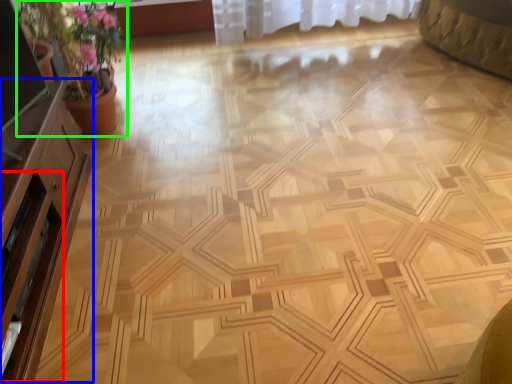
Question: Which object is the closest to the screen door (highlighted by a red box)? Choose among these: dresser (highlighted by a blue box) or houseplant (highlighted by a green box).

Choices:
 (A) dresser
 (B) houseplant

Answer: (A)